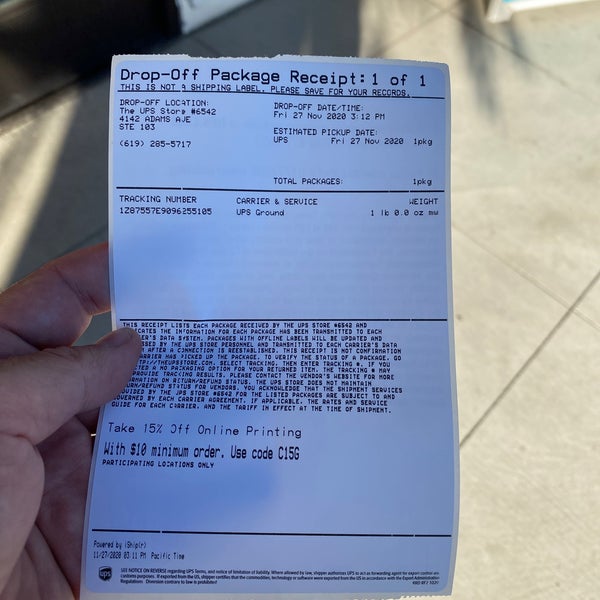
At what (x,y) coordinates should I click in order to perform the action: click on sticker. Please return your answer as a coordinate pair (x, y). Image resolution: width=600 pixels, height=600 pixels. Looking at the image, I should click on (431, 295).